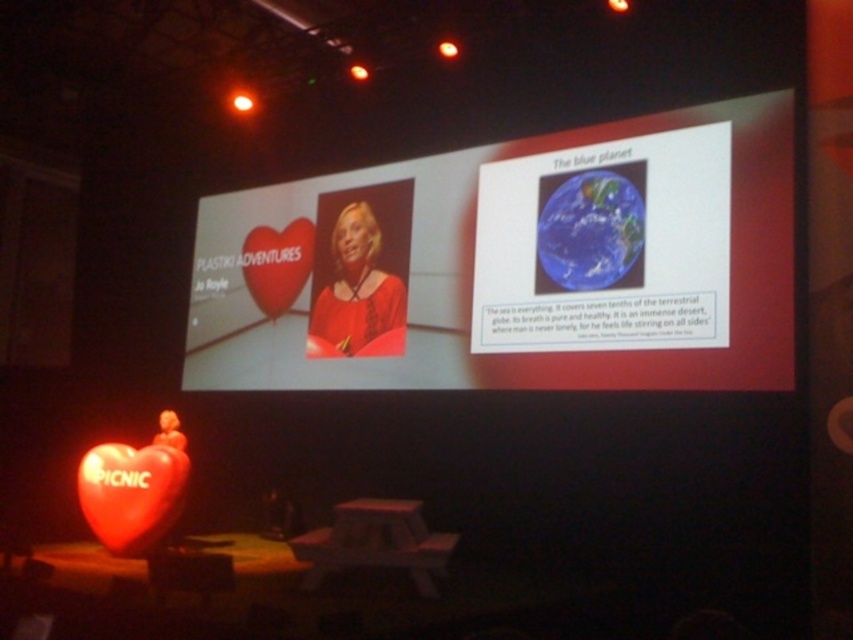
You are an attendee at the conference and you want to take a photo of both the white glossy projection screen at upper center and the blue glossy earth at upper right. Which object should you point your camera towards first if you want to capture both in a single frame without moving the camera?

You should point your camera towards the white glossy projection screen at upper center first since it is to the left of the blue glossy earth at upper right, allowing both to be captured in a single frame without moving the camera.